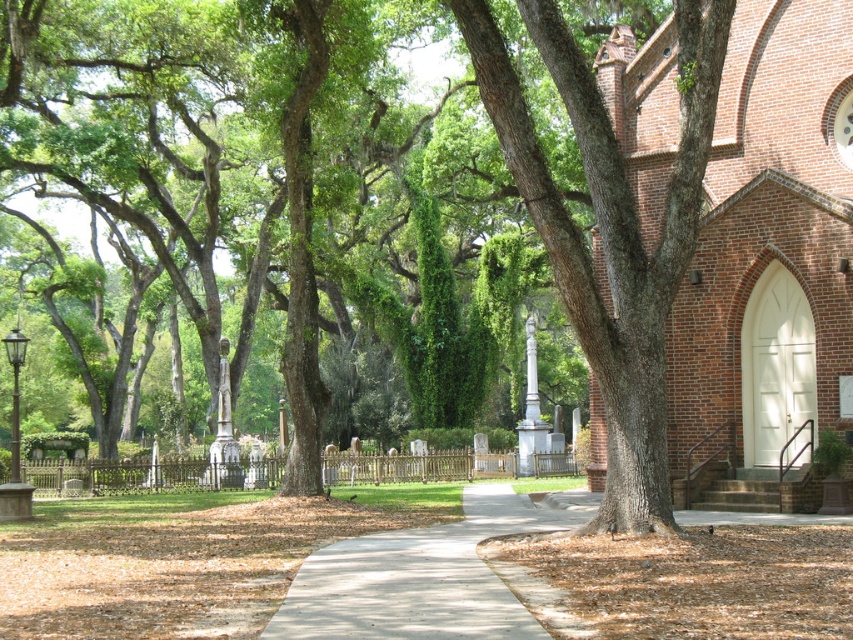
Question: Is smooth brown bark at center below gray concrete sidewalk at center?

Choices:
 (A) no
 (B) yes

Answer: (A)

Question: Estimate the real-world distances between objects in this image. Which object is farther from the smooth brown bark at center?

Choices:
 (A) brick church at center
 (B) gray concrete sidewalk at center

Answer: (A)

Question: Does smooth brown bark at center appear on the left side of gray concrete sidewalk at center?

Choices:
 (A) yes
 (B) no

Answer: (B)

Question: Among these points, which one is nearest to the camera?

Choices:
 (A) (607, 528)
 (B) (726, 504)
 (C) (426, 566)

Answer: (C)

Question: Does smooth brown bark at center appear on the left side of gray concrete sidewalk at center?

Choices:
 (A) no
 (B) yes

Answer: (A)

Question: Which of the following is the closest to the observer?

Choices:
 (A) gray concrete sidewalk at center
 (B) brick church at center
 (C) smooth brown bark at center

Answer: (A)